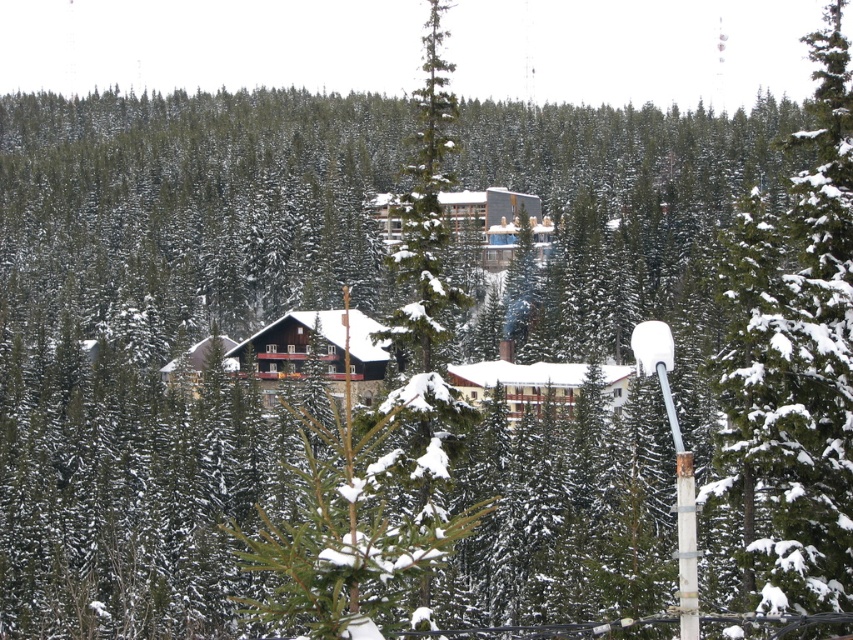
You are a photographer planning to capture a wide shot of the green textured pine tree at center and the dark brown wooden cabin at center from a distance. Based on their sizes, which object will appear wider in the photo?

The green textured pine tree at center will appear wider in the photo because its width is larger than that of the dark brown wooden cabin at center.

You are standing at the bottom of the image and looking upwards. Which object is located at the point with coordinates (793, 362)?

The point with coordinates (793, 362) corresponds to the green textured pine tree at center.